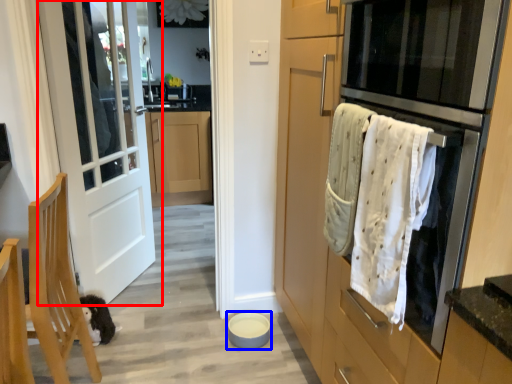
Question: Which of the following is the farthest to the observer, door (highlighted by a red box) or appliance (highlighted by a blue box)?

Choices:
 (A) door
 (B) appliance

Answer: (B)